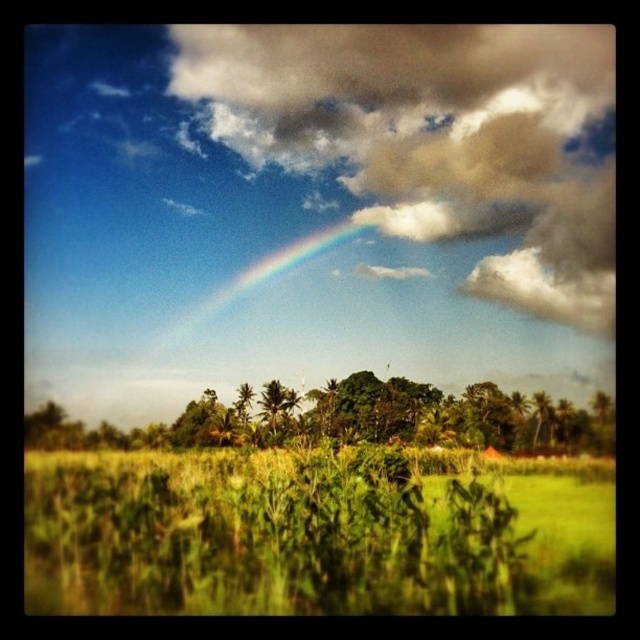
You are a photographer standing in the field and want to capture the rainbow in the background. You notice a point at coordinates (355, 419) on your camera screen. What object is located at this point?

The point at coordinates (355, 419) corresponds to green leafy trees at center.

You are a photographer setting up a tripod in the middle of the green field. You want to frame both the green leafy trees at center and the green leafy palm at center in your shot. Which object should you position closer to the edge of the frame to avoid overcrowding?

The green leafy palm at center is narrower than the green leafy trees at center, so you should position the green leafy palm at center closer to the edge of the frame to avoid overcrowding.